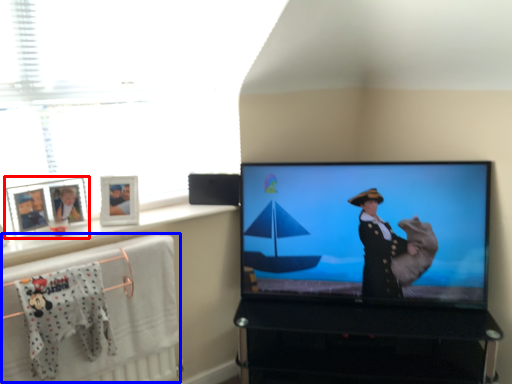
Question: Among these objects, which one is nearest to the camera, picture frame (highlighted by a red box) or bath towel (highlighted by a blue box)?

Choices:
 (A) picture frame
 (B) bath towel

Answer: (B)